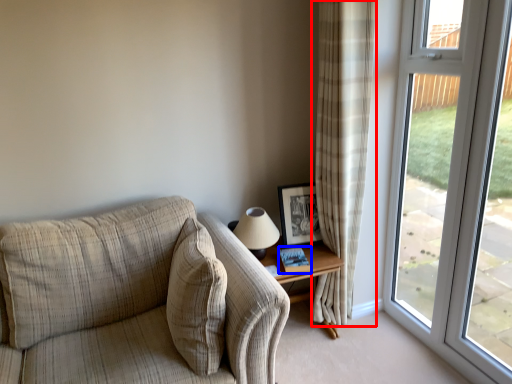
Question: Which object is further to the camera taking this photo, curtain (highlighted by a red box) or book (highlighted by a blue box)?

Choices:
 (A) curtain
 (B) book

Answer: (B)